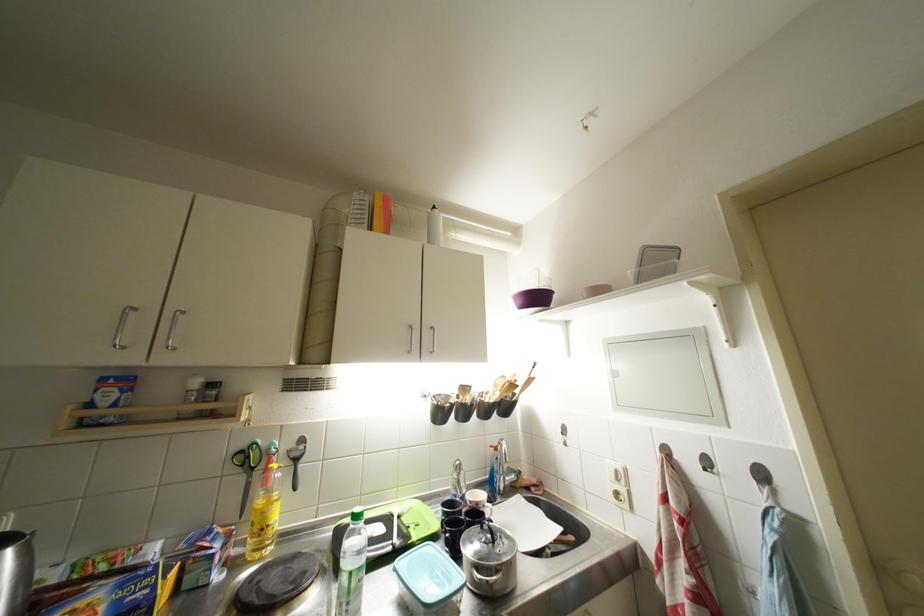
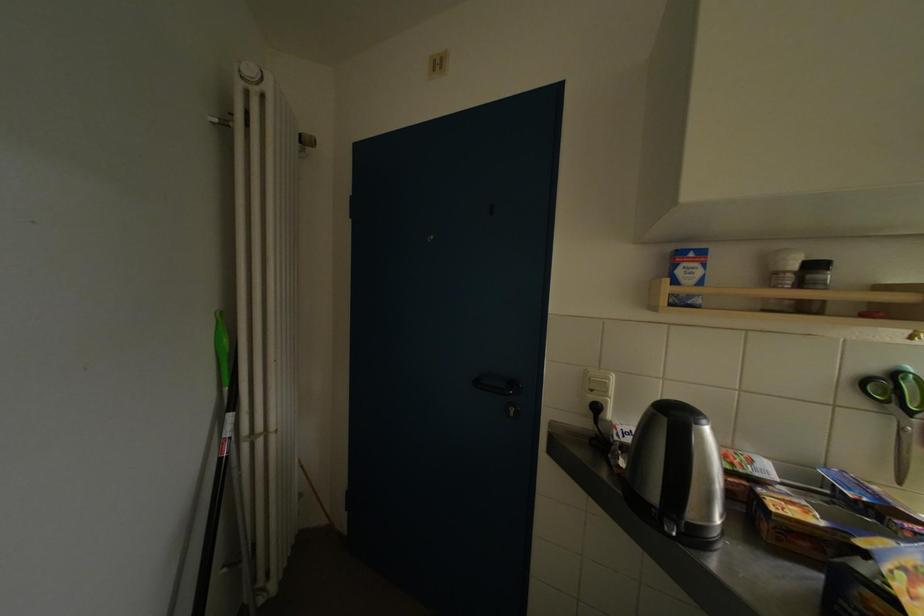
Question: The camera is either moving clockwise (left) or counter-clockwise (right) around the object. The first image is from the beginning of the video and the second image is from the end. Is the camera moving left or right when shooting the video?

Choices:
 (A) Left
 (B) Right

Answer: (B)